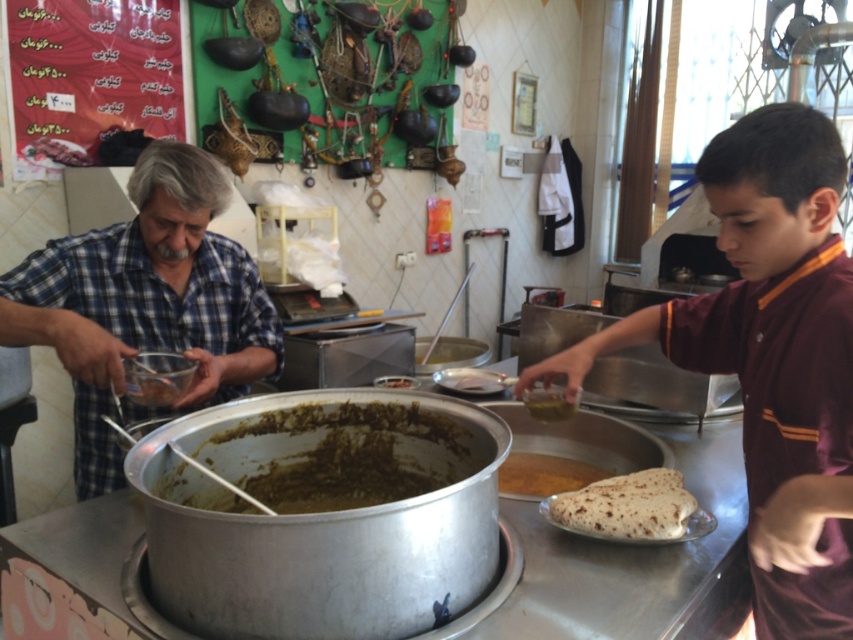
You are a customer waiting to order food in this eatery. You see a person in a maroon uniform at right and another in a blue plaid shirt at left. Which server is closer to you?

The blue plaid shirt at left is closer to you because the maroon uniform at right and blue plaid shirt at left are 33.41 inches apart, so the blue plaid shirt at left is closer to you.

You are a customer at the eatery and want to know which item is bigger between the brown matte flatbread at center and the brown matte bowl at center. Can you tell me?

The brown matte flatbread at center has a larger size compared to the brown matte bowl at center, so the flatbread is bigger.

You are a customer observing two staff members in the kitchen. The staff member wearing the maroon uniform at right is trying to pass a tray to the staff member in the blue plaid shirt at left. Considering their clothing widths, which staff member should move closer to make the handoff easier?

The maroon uniform at right has a lesser width compared to the blue plaid shirt at left, so the staff member in the maroon uniform at right should move closer to make the handoff easier since their clothing is narrower and requires less space.